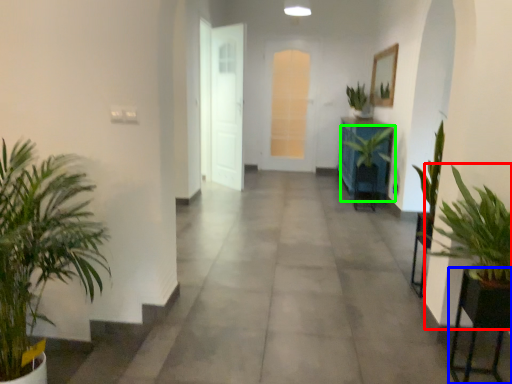
Question: Which is nearer to the houseplant (highlighted by a red box)? furniture (highlighted by a blue box) or houseplant (highlighted by a green box).

Choices:
 (A) furniture
 (B) houseplant

Answer: (A)